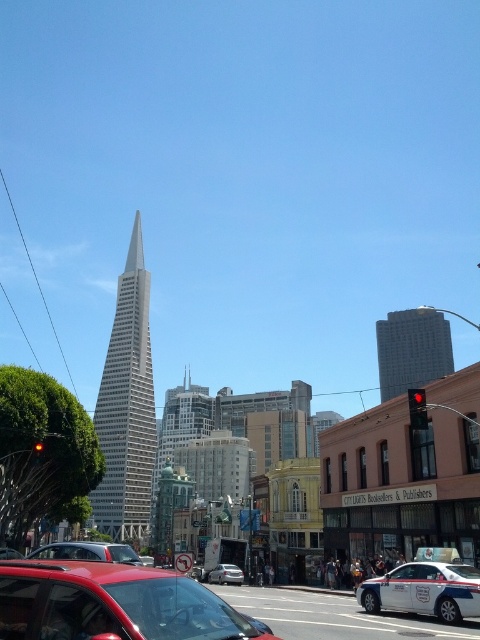
Does white glossy police car at lower right appear under metallic red traffic light at center-right?

Yes, white glossy police car at lower right is below metallic red traffic light at center-right.

Who is shorter, white glossy police car at lower right or metallic red traffic light at center-right?

metallic red traffic light at center-right is shorter.

Is point (431, 596) positioned after point (425, 413)?

That is False.

The width and height of the screenshot is (480, 640). What are the coordinates of `white glossy police car at lower right` in the screenshot? It's located at (424, 589).

Who is higher up, metallic red traffic light at center-right or red glass traffic light at left?

metallic red traffic light at center-right

Which is behind, point (408, 403) or point (40, 445)?

Point (40, 445)

Identify the location of metallic red traffic light at center-right. (417, 408).

Does matte red car at lower left have a greater height compared to metallic silver sedan at center?

Indeed, matte red car at lower left has a greater height compared to metallic silver sedan at center.

Which is behind, point (108, 611) or point (222, 580)?

The point (222, 580) is more distant.

Find the location of `matte red car at lower left`. matte red car at lower left is located at coordinates (111, 604).